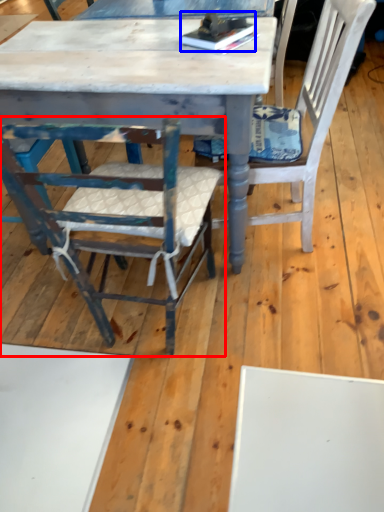
Question: Which object appears closest to the camera in this image, chair (highlighted by a red box) or book (highlighted by a blue box)?

Choices:
 (A) chair
 (B) book

Answer: (A)